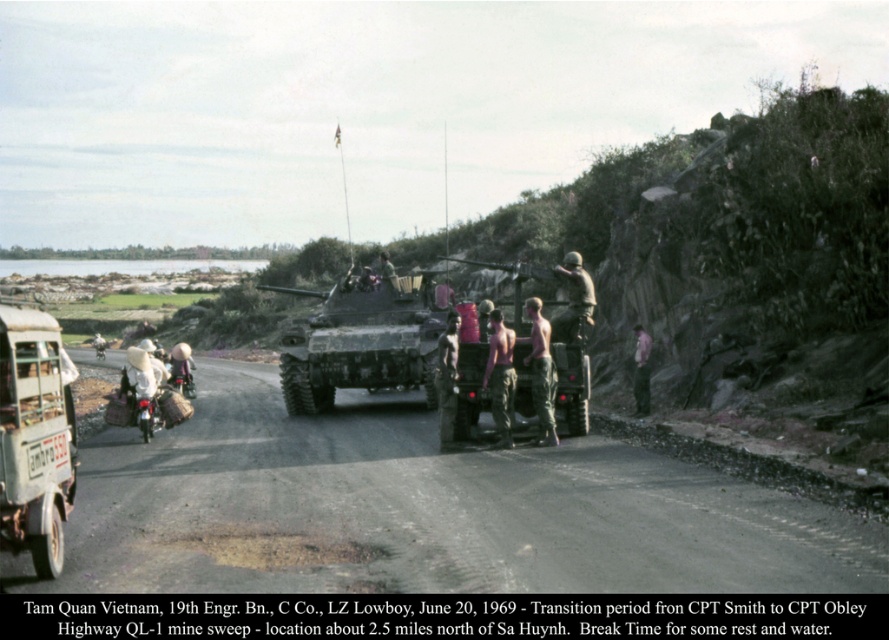
Is the position of white cloth hat at left more distant than that of white fabric hat at left?

No, white cloth hat at left is closer to the viewer.

Who is more distant from viewer, (x=123, y=371) or (x=171, y=358)?

Point (x=171, y=358)

The width and height of the screenshot is (889, 640). Identify the location of white cloth hat at left. (138, 381).

Is camouflage pants at center thinner than white cloth hat at left?

Yes, camouflage pants at center is thinner than white cloth hat at left.

Locate an element on the screen. camouflage pants at center is located at coordinates (541, 371).

Is skinny man at center wider than pink fabric shirt at center-right?

Yes.

Can you confirm if skinny man at center is positioned below pink fabric shirt at center-right?

Correct, skinny man at center is located below pink fabric shirt at center-right.

Where is `skinny man at center`? skinny man at center is located at coordinates (447, 380).